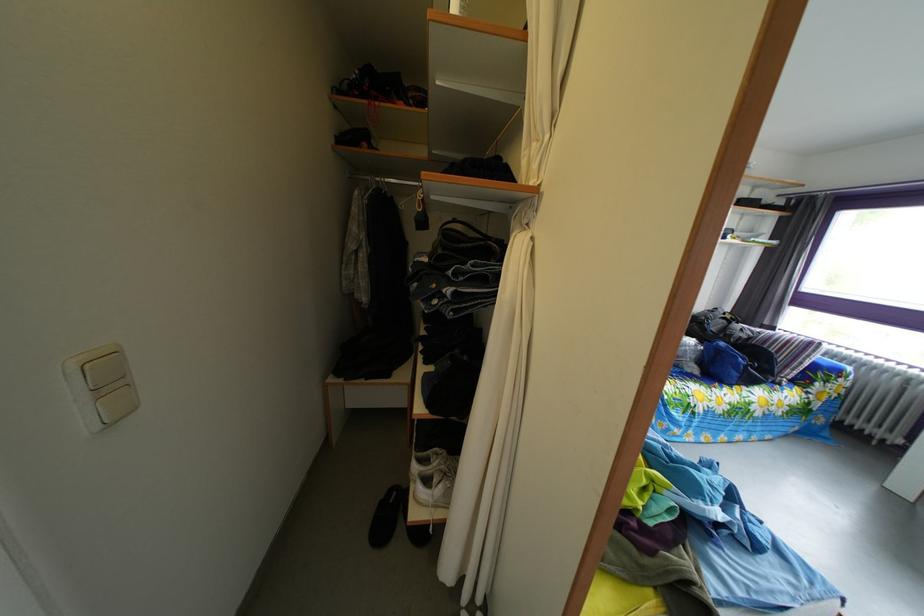
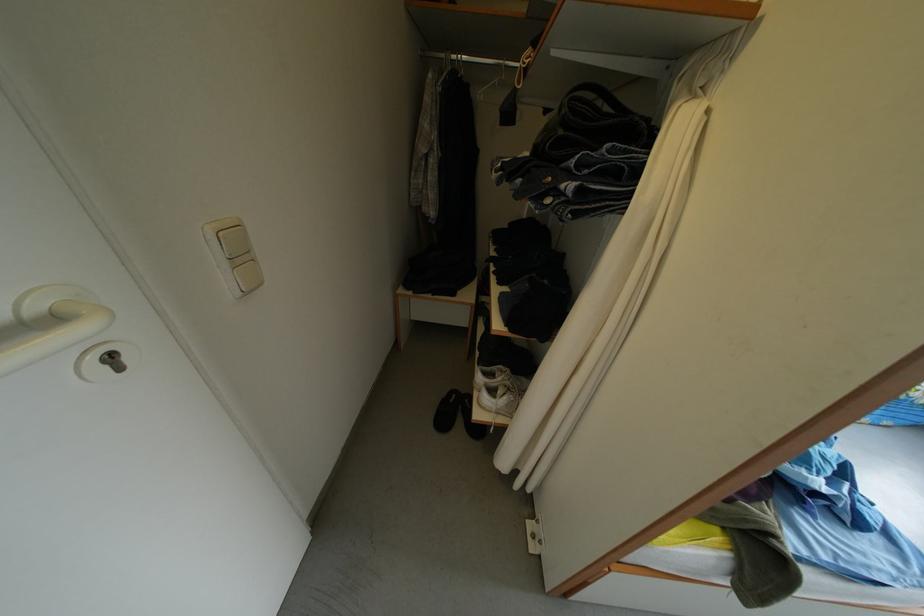
The point at (122, 392) is marked in the first image. Where is the corresponding point in the second image?

(251, 265)